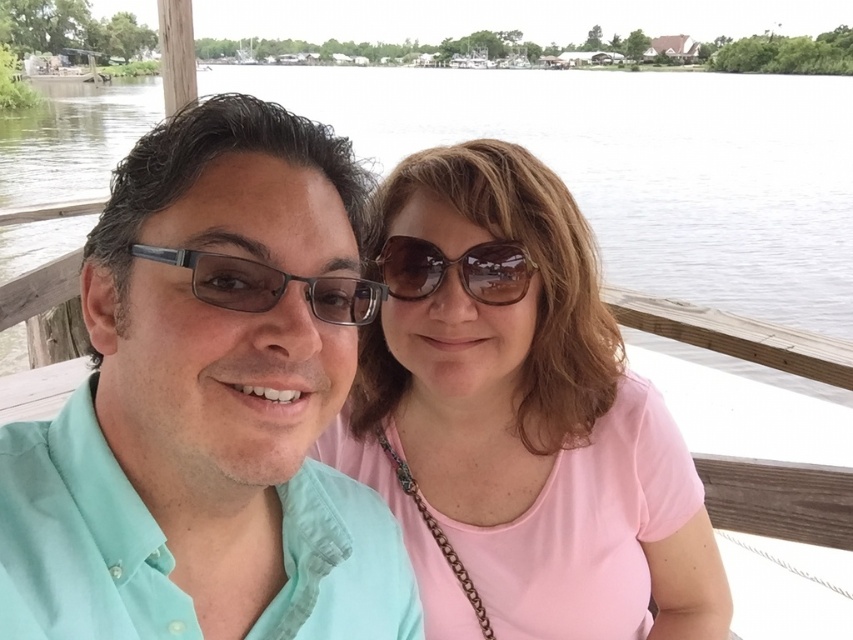
Question: Based on their relative distances, which object is farther from the pink fabric shirt at center?

Choices:
 (A) transparent water at center
 (B) matte black glasses at center
 (C) matte teal shirt at left

Answer: (A)

Question: Which object appears closest to the camera in this image?

Choices:
 (A) brown matte sunglasses at center
 (B) transparent water at center
 (C) matte teal shirt at left
 (D) pink fabric shirt at center

Answer: (C)

Question: Among these points, which one is nearest to the camera?

Choices:
 (A) (125, 400)
 (B) (585, 104)
 (C) (360, 314)
 (D) (399, 268)

Answer: (A)

Question: Is matte black glasses at center to the right of brown matte sunglasses at center from the viewer's perspective?

Choices:
 (A) no
 (B) yes

Answer: (A)

Question: Does transparent water at center appear under brown matte sunglasses at center?

Choices:
 (A) yes
 (B) no

Answer: (B)

Question: Is matte teal shirt at left further to the viewer compared to matte black glasses at center?

Choices:
 (A) no
 (B) yes

Answer: (A)